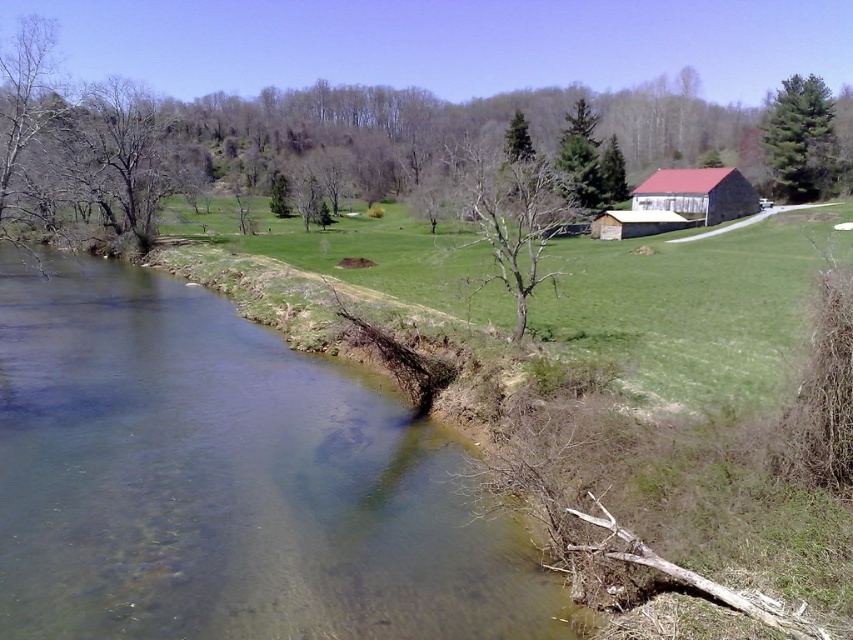
Question: Estimate the real-world distances between objects in this image. Which object is closer to the bare wood tree at center?

Choices:
 (A) green textured pine tree at upper right
 (B) green grassy field at center

Answer: (B)

Question: Does green grassy field at center have a lesser width compared to red corrugated metal barn at right?

Choices:
 (A) no
 (B) yes

Answer: (A)

Question: Can you confirm if clear water at lower left is positioned below green textured pine tree at upper right?

Choices:
 (A) yes
 (B) no

Answer: (A)

Question: Which is nearer to the bare wood tree at center?

Choices:
 (A) bare branches at left
 (B) green grassy field at center
 (C) wooden barn at center-right
 (D) clear water at lower left

Answer: (B)

Question: Which point is closer to the camera?

Choices:
 (A) bare branches at left
 (B) green grassy field at center

Answer: (B)

Question: Is clear water at lower left bigger than green textured pine tree at upper right?

Choices:
 (A) no
 (B) yes

Answer: (A)